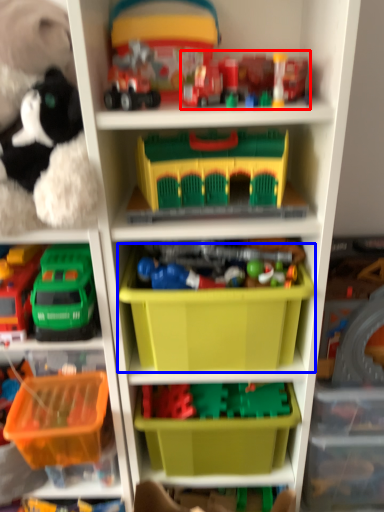
Question: Which of the following is the farthest to the observer, toy (highlighted by a red box) or storage box (highlighted by a blue box)?

Choices:
 (A) toy
 (B) storage box

Answer: (B)